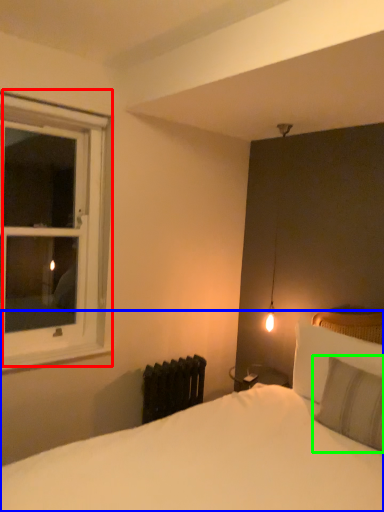
Question: Which object is positioned closest to window (highlighted by a red box)? Select from bed (highlighted by a blue box) and pillow (highlighted by a green box).

Choices:
 (A) bed
 (B) pillow

Answer: (A)